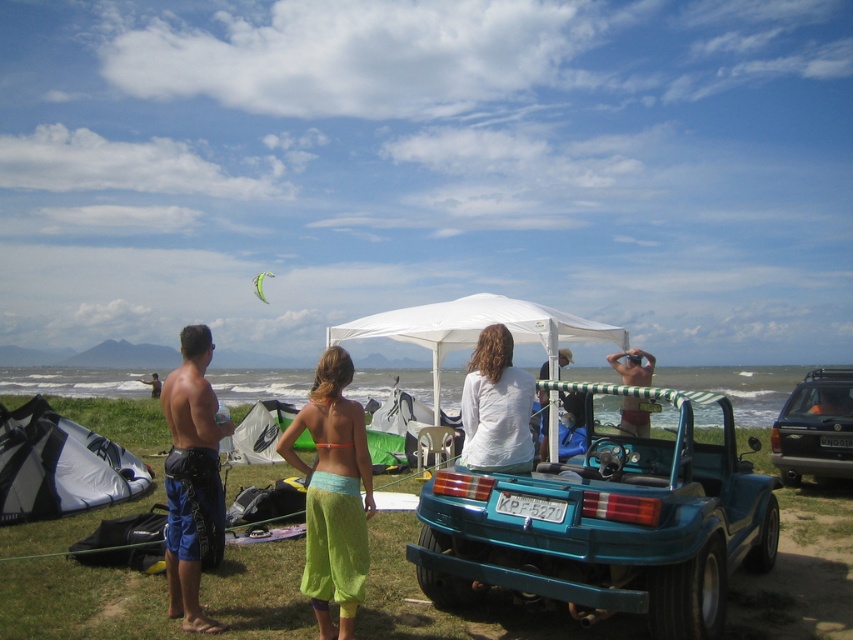
From the picture: You are a photographer trying to capture both the white fabric kite at lower left and the green fabric kite at upper center in a single shot. Which kite should you focus on first to ensure both are in frame?

The white fabric kite at lower left should be focused on first since it is positioned to the right of the green fabric kite at upper center, allowing the photographer to adjust the camera angle to include both in the frame.

You are standing at the point marked as point (24, 429). You want to throw a frisbee to your friend who is at the other end of the beach. If the beach is 10 meters wide, can you reach your friend without the frisbee going into the water?

The distance between you and your friend is 8.52 meters, which is less than the beach width of 10 meters. Therefore, you can throw the frisbee to your friend without it entering the water.

You are planning to fly the white fabric kite at lower left near the white matte tent at center. Based on their sizes, will the kite be visible above the tent when it is fully extended?

The white fabric kite at lower left is shorter than the white matte tent at center, so when fully extended, the kite will not be visible above the tent.